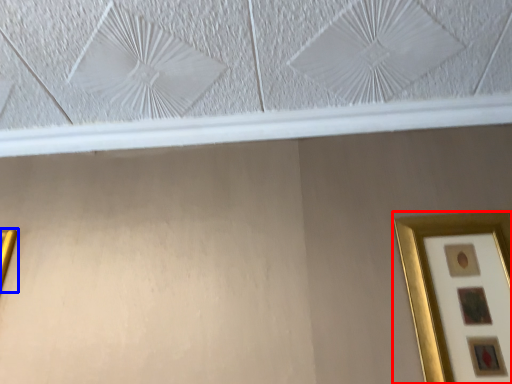
Question: Which object appears closest to the camera in this image, picture frame (highlighted by a red box) or picture frame (highlighted by a blue box)?

Choices:
 (A) picture frame
 (B) picture frame

Answer: (A)